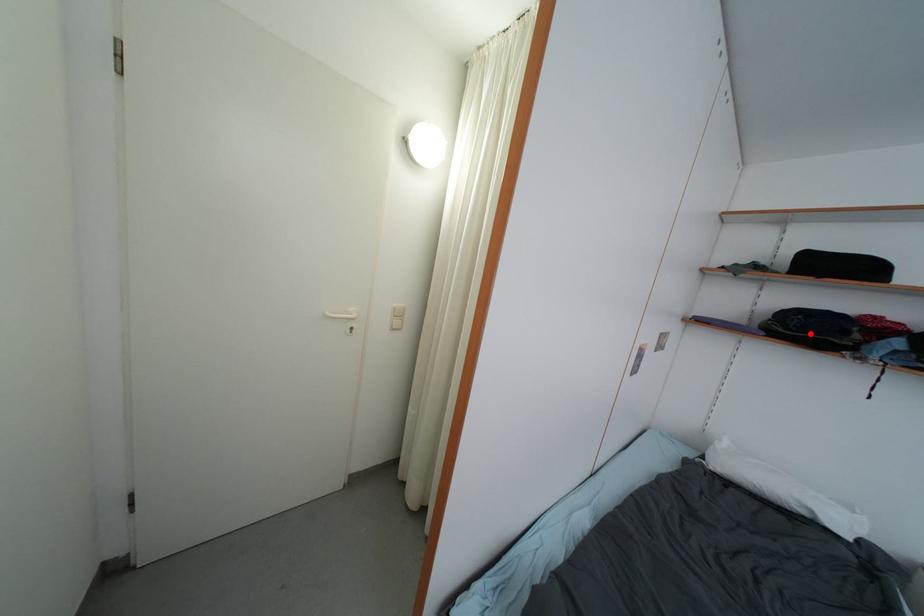
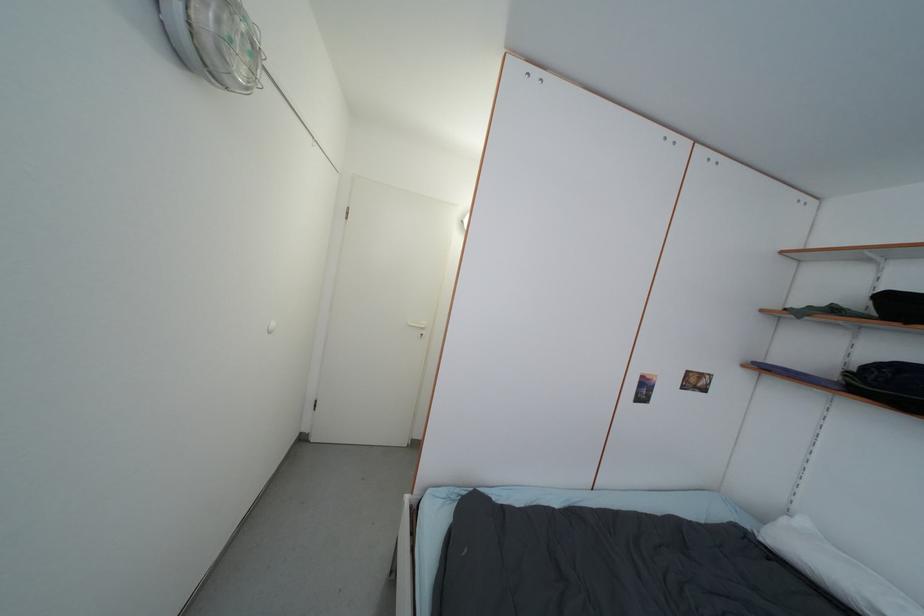
Find the pixel in the second image that matches the highlighted location in the first image.

(906, 392)